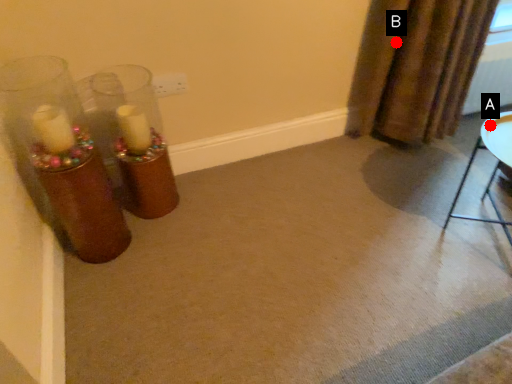
Question: Two points are circled on the image, labeled by A and B beside each circle. Which point appears farthest from the camera in this image?

Choices:
 (A) A is further
 (B) B is further

Answer: (B)